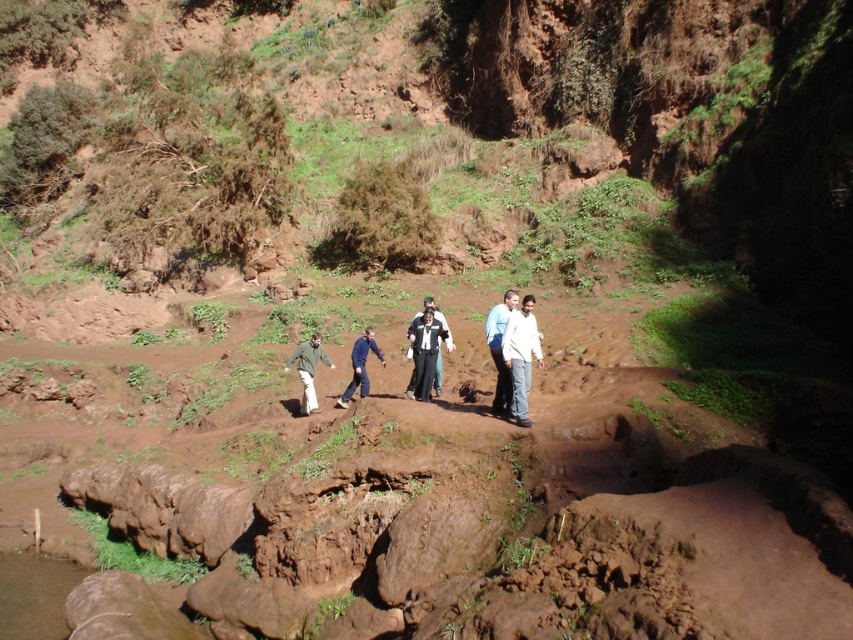
Question: Is black matte pants at center wider than blue fabric pants at center?

Choices:
 (A) no
 (B) yes

Answer: (A)

Question: Among these points, which one is nearest to the camera?

Choices:
 (A) (509, 355)
 (B) (431, 342)
 (C) (364, 381)

Answer: (A)

Question: Which of the following is the closest to the observer?

Choices:
 (A) green matte jacket at center
 (B) white matte shirt at center

Answer: (B)

Question: Where is white matte shirt at center located in relation to green matte jacket at center in the image?

Choices:
 (A) below
 (B) above

Answer: (B)

Question: Which point is farther to the camera?

Choices:
 (A) black matte pants at center
 (B) white matte shirt at center

Answer: (A)

Question: Does white matte shirt at center appear over blue fabric pants at center?

Choices:
 (A) no
 (B) yes

Answer: (B)